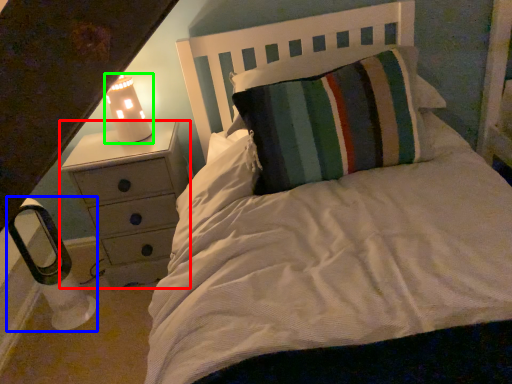
Question: Which is nearer to the chest of drawers (highlighted by a red box)? lamp (highlighted by a blue box) or lamp (highlighted by a green box).

Choices:
 (A) lamp
 (B) lamp

Answer: (B)